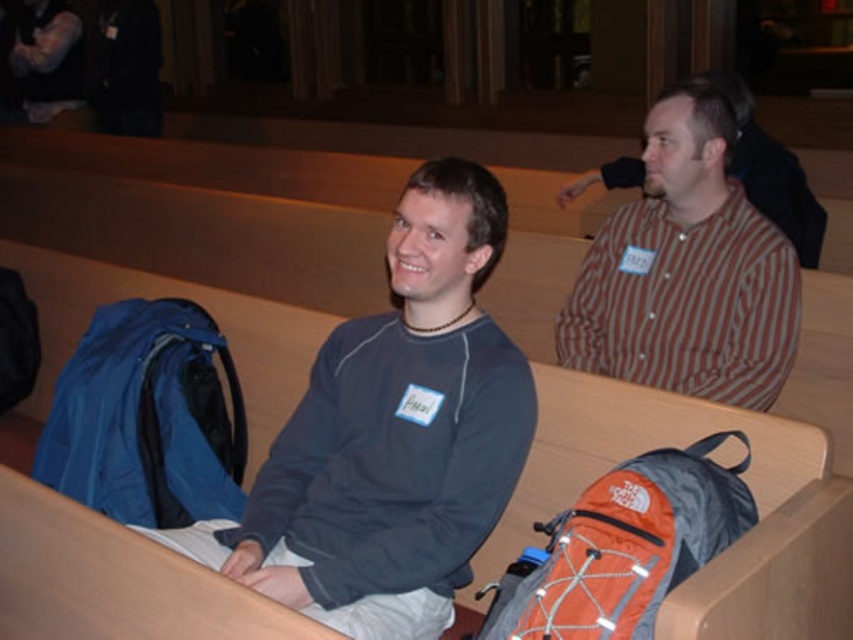
You are organizing a photo shoot and need to position two models based on their clothing. The first model wears a matte gray sweater at center, and the second wears a striped cotton shirt at upper right. According to the scene, which model is positioned to the left of the other?

The matte gray sweater at center is to the left of striped cotton shirt at upper right.

You are standing at the entrance of the conference room and want to retrieve your blue fabric backpack at lower left. Which direction should you move to reach it?

The blue fabric backpack at lower left is located at point [148,419], so you should move towards the lower left direction to reach it.